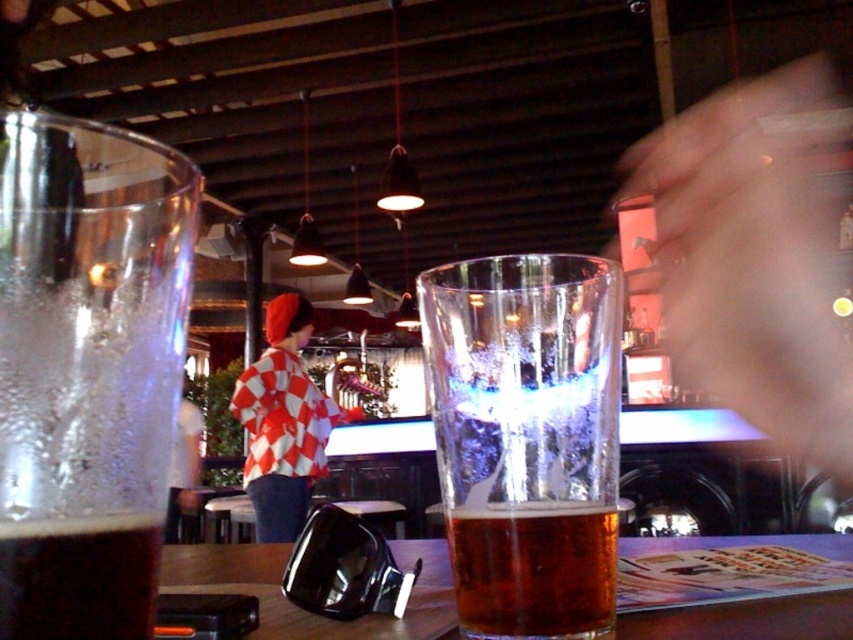
Is translucent glass beer at center to the left of brown matte beer at lower left from the viewer's perspective?

No, translucent glass beer at center is not to the left of brown matte beer at lower left.

Measure the distance from translucent glass beer at center to brown matte beer at lower left.

translucent glass beer at center is 7.88 inches away from brown matte beer at lower left.

Who is more distant from viewer, (497, 259) or (114, 561)?

The point (497, 259) is more distant.

You are a GUI agent. You are given a task and a screenshot of the screen. Output one action in this format:
    pyautogui.click(x=<x>, y=<y>)
    Task: Click on the translucent glass beer at center
    
    Given the screenshot: What is the action you would take?
    pyautogui.click(x=526, y=438)

Is translucent glass beer at left to the left of wooden table at center from the viewer's perspective?

Indeed, translucent glass beer at left is positioned on the left side of wooden table at center.

Can you confirm if translucent glass beer at left is positioned below wooden table at center?

Incorrect, translucent glass beer at left is not positioned below wooden table at center.

Between point (82, 310) and point (413, 557), which one is positioned in front?

Point (82, 310) is more forward.

At what (x,y) coordinates should I click in order to perform the action: click on translucent glass beer at left. Please return your answer as a coordinate pair (x, y). Looking at the image, I should click on (86, 371).

Can you confirm if amber glass beer at center is positioned above red checkered shirt at center?

Correct, amber glass beer at center is located above red checkered shirt at center.

Between amber glass beer at center and red checkered shirt at center, which one is positioned higher?

amber glass beer at center is higher up.

Is point (558, 598) farther from viewer compared to point (258, 376)?

No, it is not.

Where is `amber glass beer at center`? amber glass beer at center is located at coordinates (534, 570).